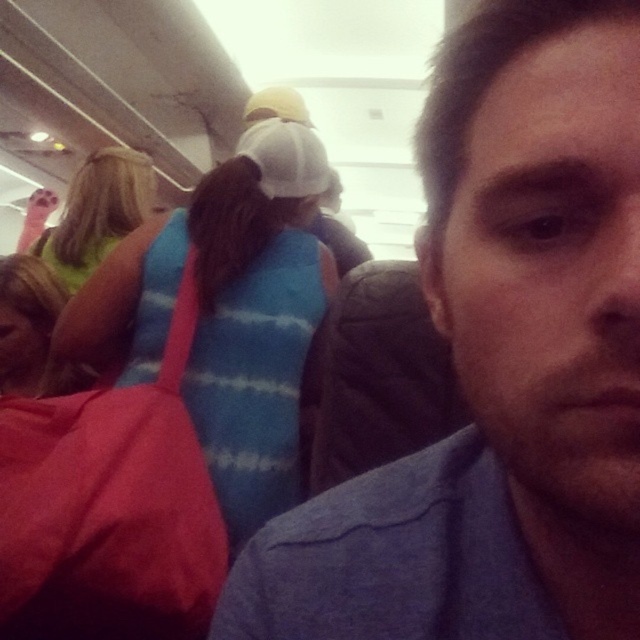
Is point (586, 202) less distant than point (232, 241)?

That is True.

Between blue cotton shirt at center and blue striped sweater at upper center, which one appears on the left side from the viewer's perspective?

Positioned to the left is blue striped sweater at upper center.

The image size is (640, 640). What are the coordinates of `blue cotton shirt at center` in the screenshot? It's located at [499, 365].